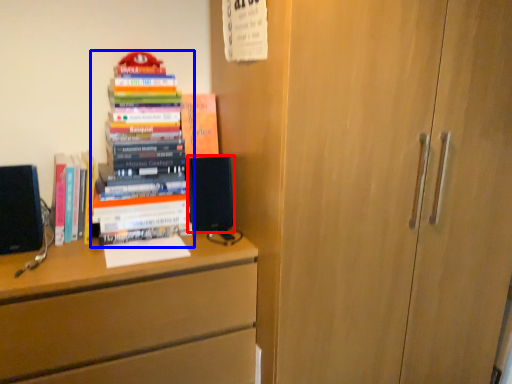
Question: Which point is closer to the camera, speaker (highlighted by a red box) or book (highlighted by a blue box)?

Choices:
 (A) speaker
 (B) book

Answer: (B)